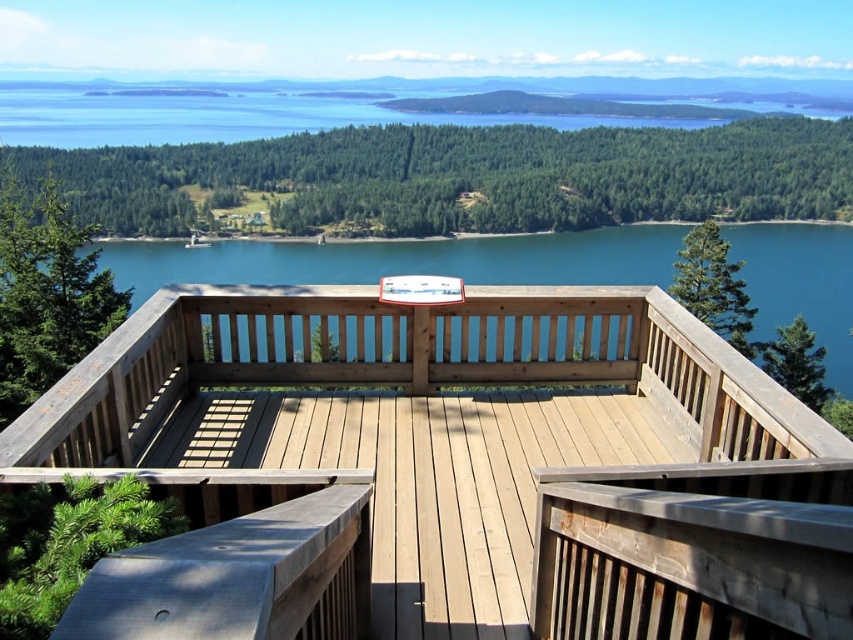
Who is positioned more to the right, natural wood deck at center or blue wooden water at center?

blue wooden water at center is more to the right.

Between point (628, 417) and point (231, 276), which one is positioned in front?

Positioned in front is point (628, 417).

I want to click on natural wood deck at center, so click(x=445, y=472).